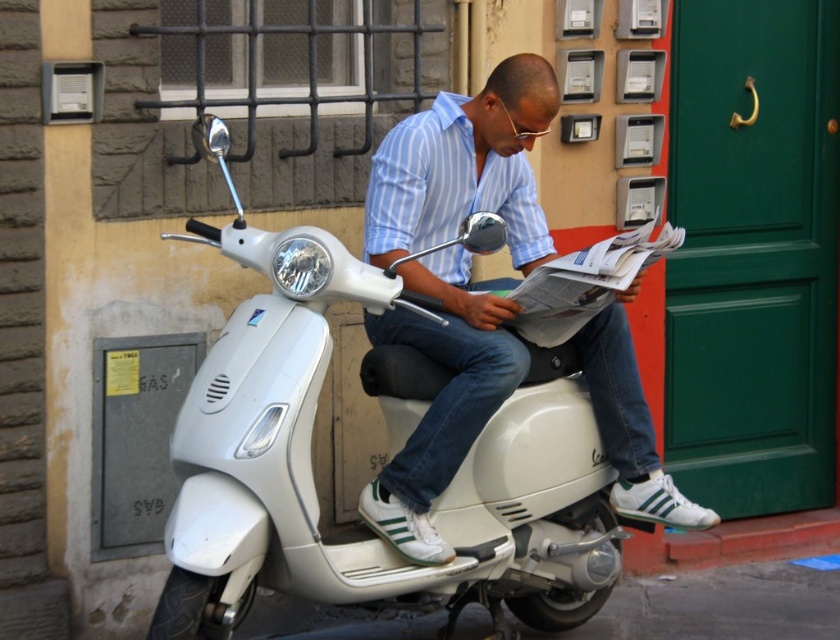
You are a delivery person who needs to attach a package to your white matte motorbike at center. The package must be placed exactly at the coordinates point (x=312, y=474). Can you confirm if this point is on your white matte motorbike at center?

Yes, the point (x=312, y=474) is on the white matte motorbike at center, so the package can be placed there.

You are a delivery person needing to park your vehicle between the white matte motorbike at center and the matte white scooter at center. Is there enough space for your vehicle, which is 1.5 meters wide?

The white matte motorbike at center is in front of the matte white scooter at center, but the description does not provide the distance between them. Therefore, it is unclear if there is enough space for a vehicle that is 1.5 meters wide.

Looking at this image, you are a delivery person needing to choose between the white matte motorbike at center and the matte white scooter at center for a long trip. Which one would be more suitable based on their sizes?

The white matte motorbike at center is larger in size than the matte white scooter at center, so it would be more suitable for a long trip as it likely has more space and storage capacity.